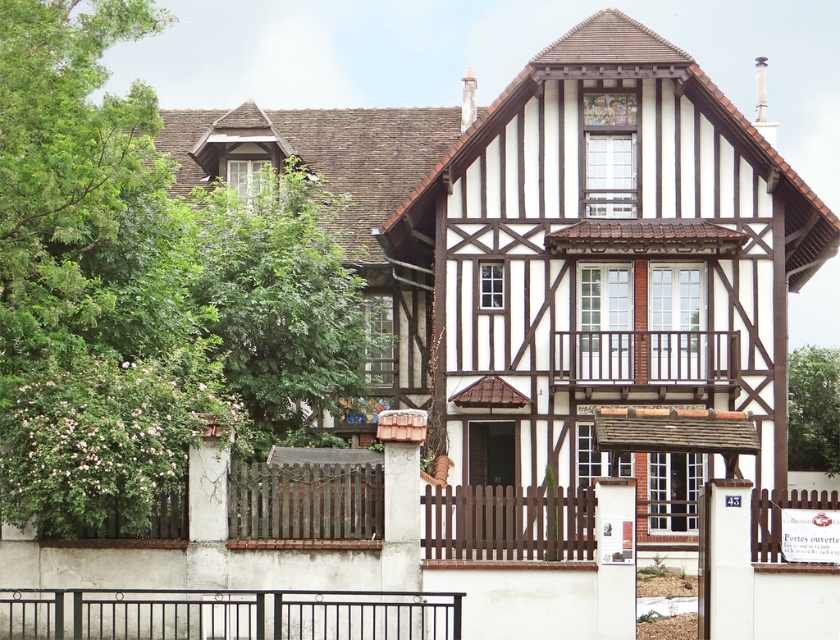
Question: Which of the following is the closest to the observer?

Choices:
 (A) green leafy tree at right
 (B) green leafy tree at upper left

Answer: (B)

Question: Which object appears farthest from the camera in this image?

Choices:
 (A) green leafy tree at upper left
 (B) green leafy tree at right

Answer: (B)

Question: From the image, what is the correct spatial relationship of green leafy tree at upper left in relation to green leafy tree at right?

Choices:
 (A) right
 (B) left

Answer: (B)

Question: Can you confirm if green leafy tree at upper left is positioned above black metal fence at lower center?

Choices:
 (A) yes
 (B) no

Answer: (A)

Question: Which of the following is the farthest from the observer?

Choices:
 (A) green leafy tree at upper left
 (B) black metal fence at lower center

Answer: (A)

Question: Can you confirm if green leafy tree at upper left is thinner than black metal fence at lower center?

Choices:
 (A) no
 (B) yes

Answer: (B)